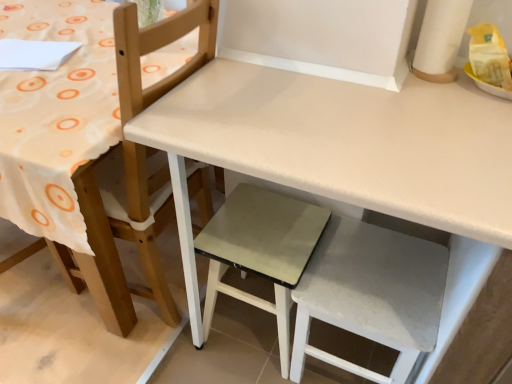
Locate an element on the screen. free spot above white matte table at center (from a real-world perspective) is located at coordinates (367, 121).